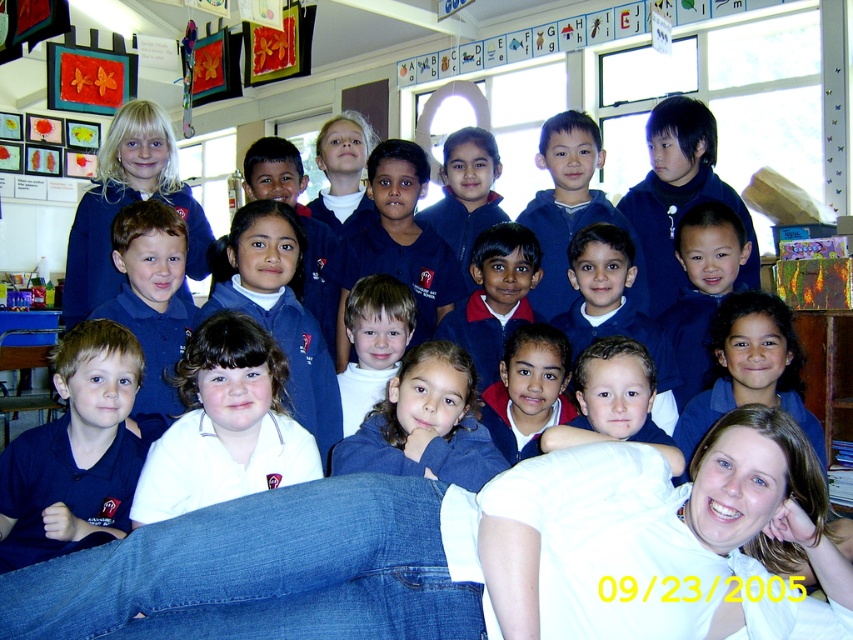
Is matte blue shirt at lower left below white turtleneck sweater at center?

Yes, matte blue shirt at lower left is below white turtleneck sweater at center.

Is point (71, 417) more distant than point (357, 387)?

No, (71, 417) is closer to viewer.

Locate an element on the screen. This screenshot has width=853, height=640. matte blue shirt at lower left is located at coordinates (74, 452).

Which is behind, point (21, 448) or point (144, 132)?

The point (144, 132) is more distant.

Is point (12, 564) farther from viewer compared to point (106, 269)?

No.

Looking at this image, who is more distant from viewer, (0, 556) or (132, 200)?

The point (132, 200) is more distant.

The image size is (853, 640). In order to click on matte blue shirt at lower left in this screenshot , I will do `click(74, 452)`.

The width and height of the screenshot is (853, 640). Describe the element at coordinates (126, 204) in the screenshot. I see `matte blue uniform at upper left` at that location.

Which of these two, matte blue uniform at upper left or white turtleneck sweater at center, stands shorter?

Standing shorter between the two is white turtleneck sweater at center.

The height and width of the screenshot is (640, 853). Describe the element at coordinates (126, 204) in the screenshot. I see `matte blue uniform at upper left` at that location.

Locate an element on the screen. This screenshot has height=640, width=853. matte blue uniform at upper left is located at coordinates pos(126,204).